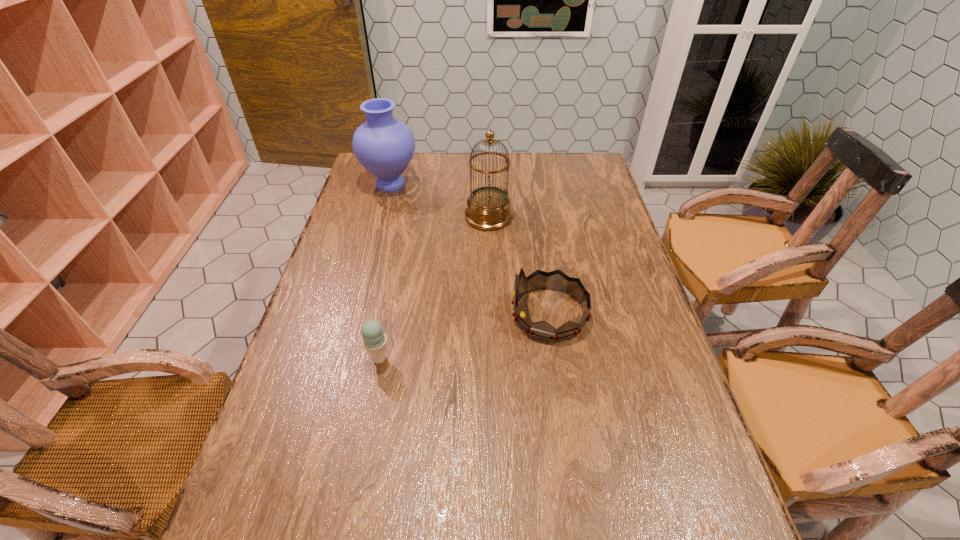
What are the coordinates of `birdcage` in the screenshot? It's located at (488, 207).

Identify the location of the farthest object. (384, 146).

Identify the location of tiara. (556, 280).

Find the location of a particular element. The height and width of the screenshot is (540, 960). the nearest object is located at coordinates (374, 340).

At what (x,y) coordinates should I click in order to perform the action: click on vacant space located 0.130m with an open door on the birdcage. Please return your answer as a coordinate pair (x, y). This screenshot has width=960, height=540. Looking at the image, I should click on (426, 217).

Locate an element on the screen. The width and height of the screenshot is (960, 540). free space located with an open door on the birdcage is located at coordinates (435, 217).

Identify the location of vacant space situated with an open door on the birdcage. The width and height of the screenshot is (960, 540). (418, 217).

I want to click on vacant point located on the front of the vase, so click(x=368, y=268).

Locate an element on the screen. blank space located 0.170m at the front of the third farthest object with jewels is located at coordinates (446, 314).

What are the coordinates of `vacant position located at the front of the third farthest object with jewels` in the screenshot? It's located at (364, 314).